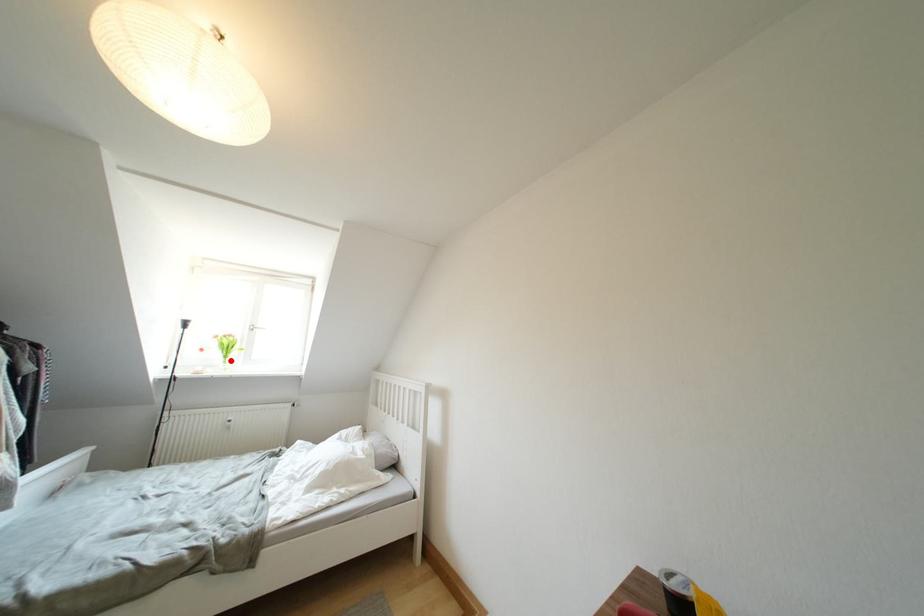
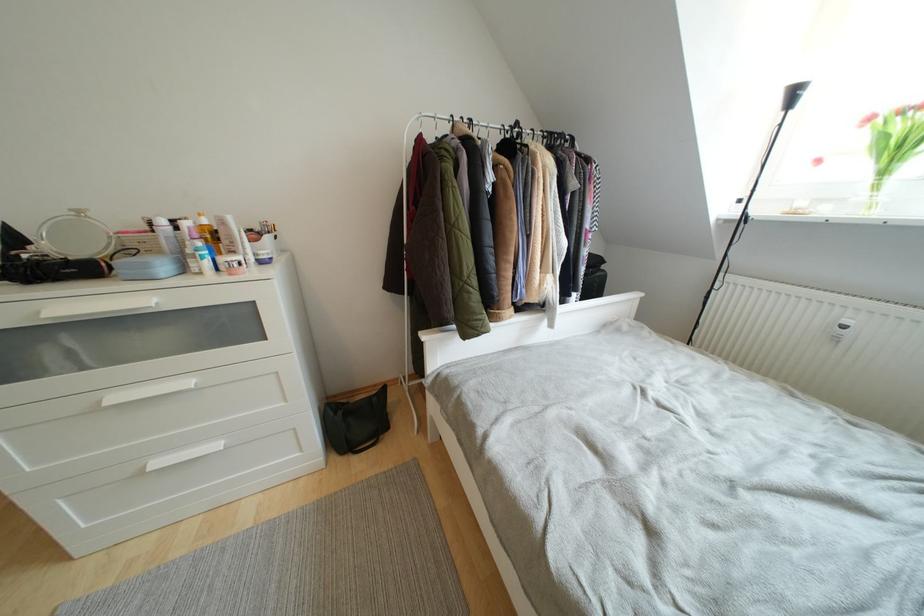
In the second image, find the point that corresponds to the highlighted location in the first image.

(890, 176)